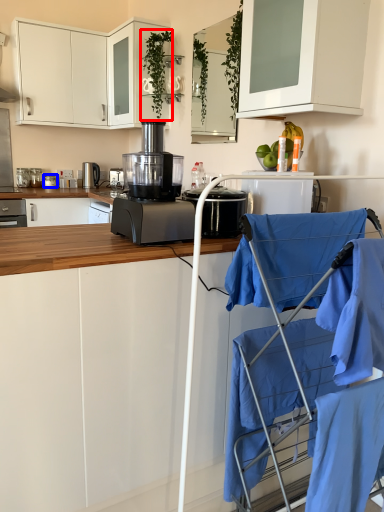
Question: Which of the following is the closest to the observer, plant (highlighted by a red box) or kitchen appliance (highlighted by a blue box)?

Choices:
 (A) plant
 (B) kitchen appliance

Answer: (A)